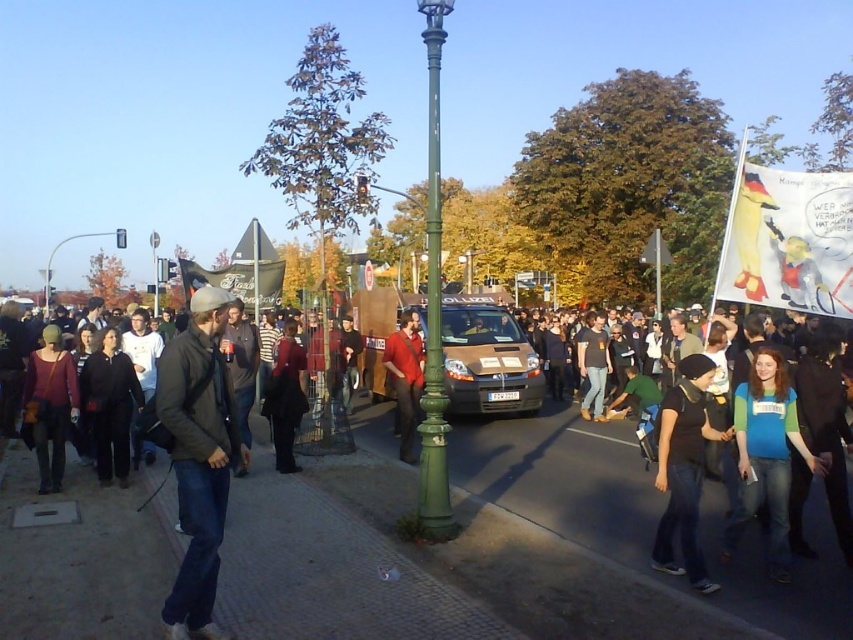
You are a participant in the protest and want to move from your current position to the exit located at point (x=154, y=269). However, there is an obstacle at point (x=171, y=429). Can you safely navigate around the obstacle to reach the exit?

Point (x=171, y=429) is in front of point (x=154, y=269), meaning the obstacle is blocking the path to the exit. You will need to find an alternative route to reach the exit safely.

You are a photographer trying to capture a photo of the protest scene. You want to ensure both the dark gray jacket at center and the brushed metal streetlamp at upper center are visible in the frame. Given their sizes, which object might you need to adjust your camera focus to better include in the shot?

The dark gray jacket at center is smaller in size compared to the brushed metal streetlamp at upper center, so you might need to adjust your camera focus to ensure the smaller dark gray jacket at center is clearly visible alongside the larger streetlamp.

You are a photographer trying to capture a photo of the protest scene. You notice two red items in the crowd. The first is a matte red sweater at left and the second is a dark red fabric coat at center. Which of these two items is located to the left of the other?

The matte red sweater at left is positioned on the left side of dark red fabric coat at center.